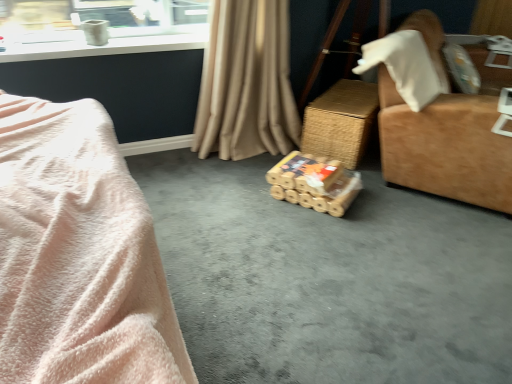
In order to click on vacant area that is in front of bamboo-textured toy at center in this screenshot , I will do `click(317, 235)`.